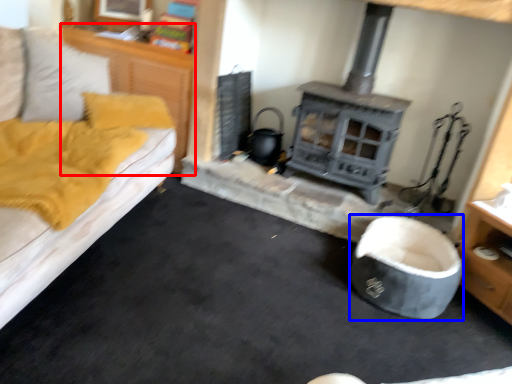
Question: Which point is closer to the camera, dresser (highlighted by a red box) or bean bag chair (highlighted by a blue box)?

Choices:
 (A) dresser
 (B) bean bag chair

Answer: (B)